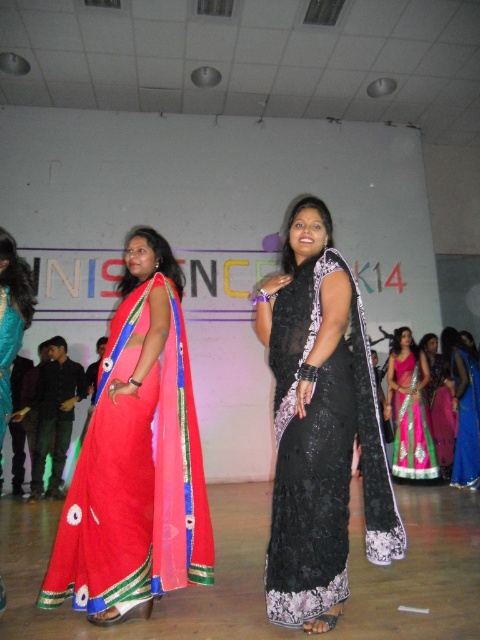
You are an event photographer at the NISNC14 event. You need to capture a photo of both the shiny teal saree at left and the black lace saree at center. Based on their positions, which saree should you focus on first to ensure both are in frame?

The shiny teal saree at left is to the left of the black lace saree at center, so you should focus on the shiny teal saree at left first to ensure both are in frame.

You are a photographer at the event and want to capture both the shiny teal saree at left and the black lace saree at center in a single frame. Given that your camera has a fixed focal length and limited horizontal field of view, which saree should you position closer to the center of the frame to ensure both are fully visible?

The shiny teal saree at left is narrower than the black lace saree at center. To ensure both are fully visible, position the wider black lace saree at center closer to the center of the frame so it can be accommodated within the limited field of view.